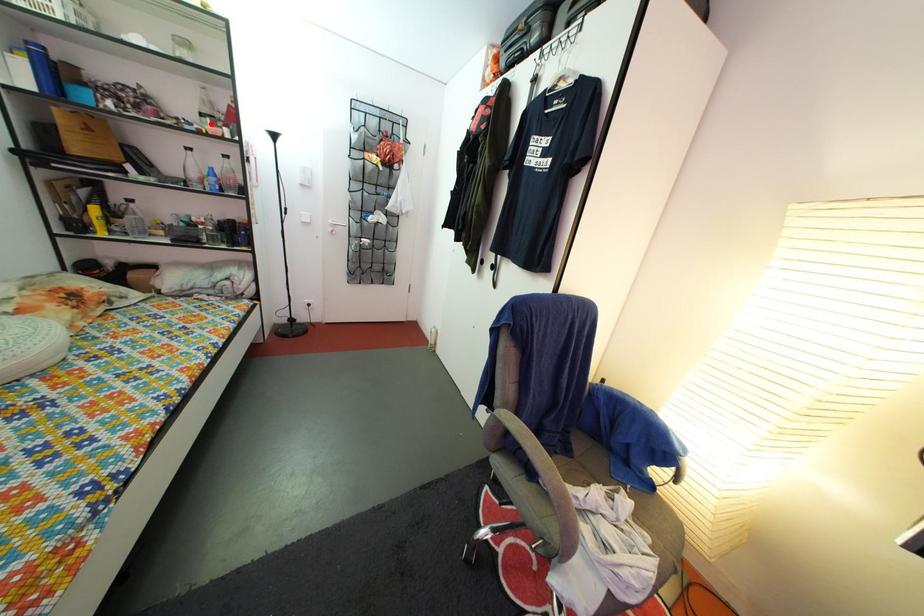
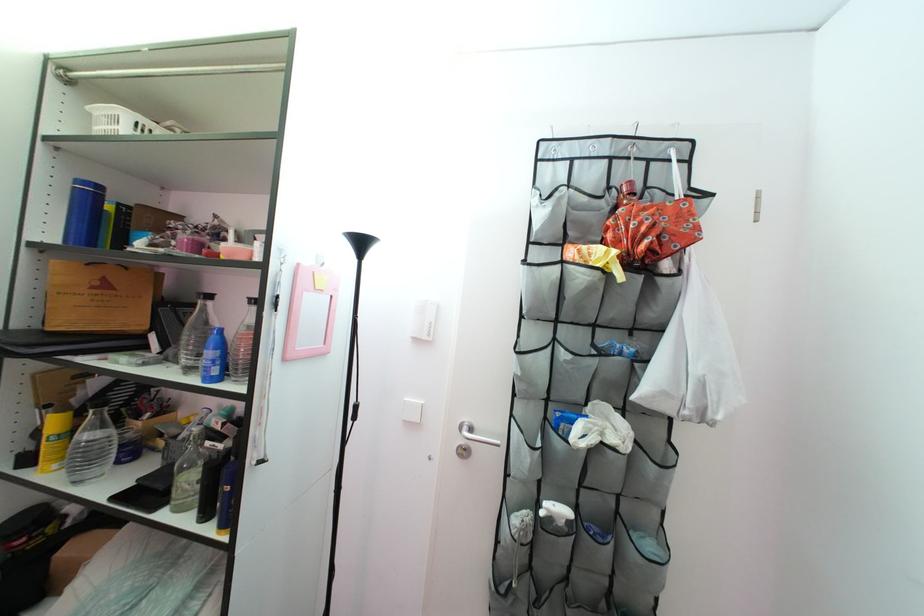
Question: I am providing you with two images of the same scene from different viewpoints. A red point is marked on the first image. Is the red point's position out of view in image 2?

Choices:
 (A) Yes
 (B) No

Answer: (A)